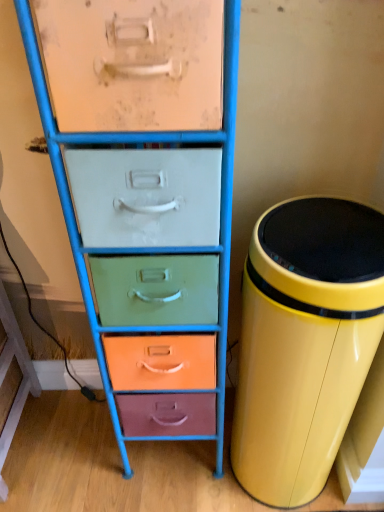
The height and width of the screenshot is (512, 384). I want to click on vacant space underneath metallic drawer unit at center (from a real-world perspective), so click(x=170, y=457).